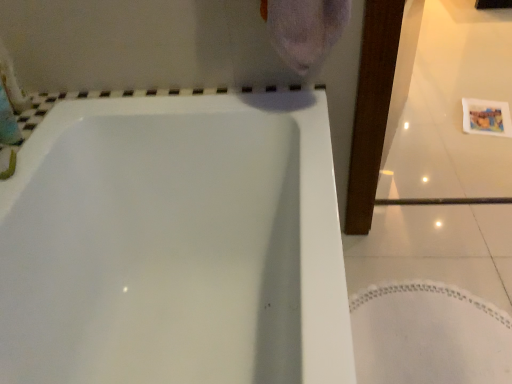
Question: Considering the positions of point (26, 258) and point (492, 314), is point (26, 258) closer or farther from the camera than point (492, 314)?

Choices:
 (A) farther
 (B) closer

Answer: (B)

Question: In terms of width, does white glossy bathtub at center look wider or thinner when compared to white fabric bath mat at lower right?

Choices:
 (A) thin
 (B) wide

Answer: (B)

Question: Which is correct: white glossy bathtub at center is inside white fabric bath mat at lower right, or outside of it?

Choices:
 (A) outside
 (B) inside

Answer: (A)

Question: Is white fabric bath mat at lower right inside the boundaries of white glossy bathtub at center, or outside?

Choices:
 (A) inside
 (B) outside

Answer: (B)

Question: Is white fabric bath mat at lower right wider or thinner than white glossy bathtub at center?

Choices:
 (A) wide
 (B) thin

Answer: (B)

Question: From a real-world perspective, is white fabric bath mat at lower right physically located above or below white glossy bathtub at center?

Choices:
 (A) above
 (B) below

Answer: (B)

Question: Is white fabric bath mat at lower right in front of or behind white glossy bathtub at center in the image?

Choices:
 (A) front
 (B) behind

Answer: (B)